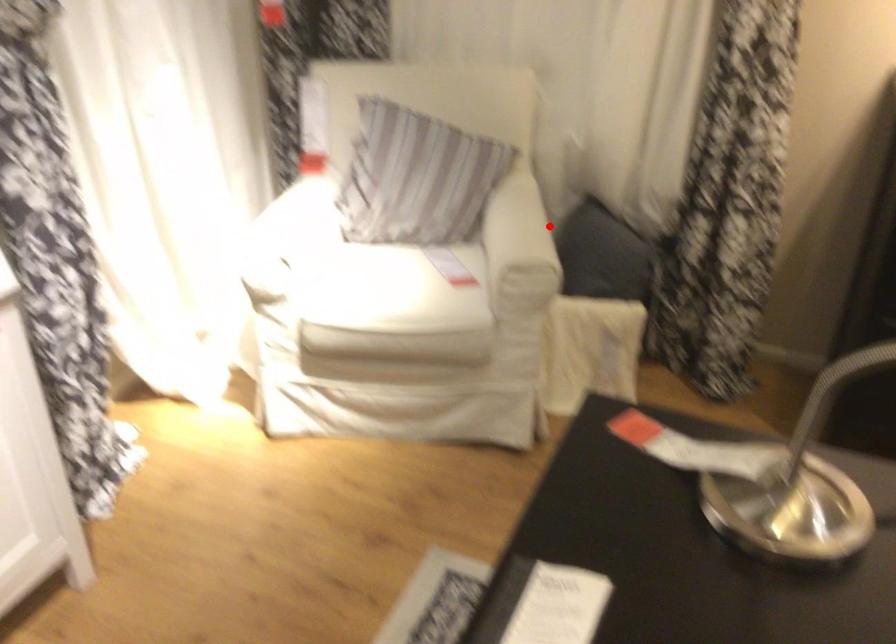
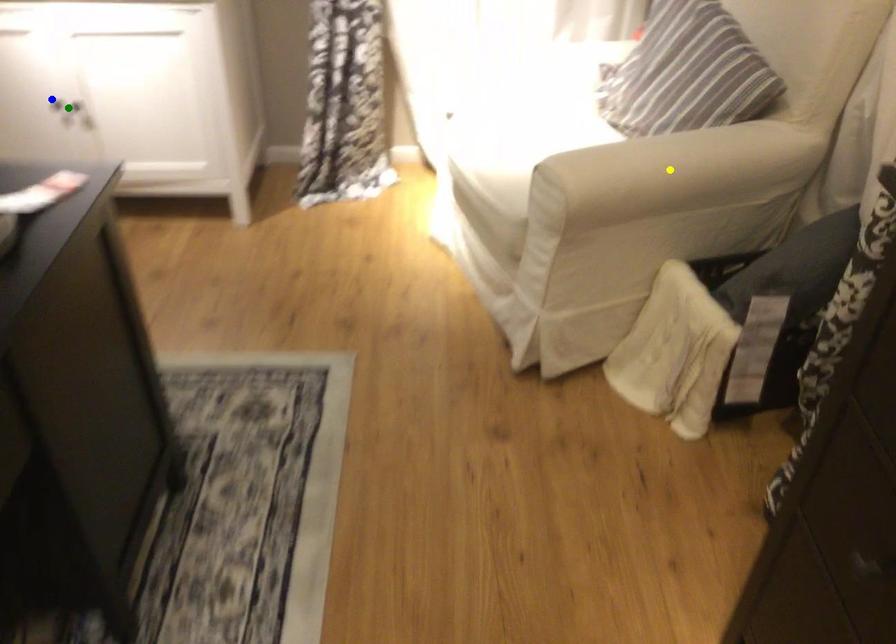
Question: I am providing you with two images of the same scene from different viewpoints. A red point is marked on the first image. You are given multiple points on the second image. Which point in image 2 is actually the same real-world point as the red point in image 1?

Choices:
 (A) yellow point
 (B) blue point
 (C) green point

Answer: (A)